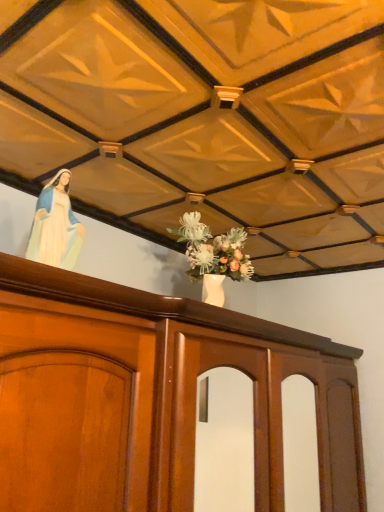
Question: Is smooth porcelain statue at upper left with wooden cabinet at center?

Choices:
 (A) no
 (B) yes

Answer: (A)

Question: Can you confirm if smooth porcelain statue at upper left is positioned to the right of wooden cabinet at center?

Choices:
 (A) no
 (B) yes

Answer: (A)

Question: Considering the relative sizes of smooth porcelain statue at upper left and wooden cabinet at center in the image provided, is smooth porcelain statue at upper left shorter than wooden cabinet at center?

Choices:
 (A) no
 (B) yes

Answer: (B)

Question: Is smooth porcelain statue at upper left looking in the opposite direction of wooden cabinet at center?

Choices:
 (A) no
 (B) yes

Answer: (A)

Question: Is smooth porcelain statue at upper left further to camera compared to wooden cabinet at center?

Choices:
 (A) no
 (B) yes

Answer: (B)

Question: From a real-world perspective, is smooth porcelain statue at upper left physically below wooden cabinet at center?

Choices:
 (A) no
 (B) yes

Answer: (A)

Question: Can you confirm if wooden cabinet at center is shorter than smooth porcelain statue at upper left?

Choices:
 (A) no
 (B) yes

Answer: (A)

Question: Can you confirm if wooden cabinet at center is wider than smooth porcelain statue at upper left?

Choices:
 (A) no
 (B) yes

Answer: (B)

Question: Does wooden cabinet at center touch smooth porcelain statue at upper left?

Choices:
 (A) no
 (B) yes

Answer: (A)

Question: Is wooden cabinet at center far away from smooth porcelain statue at upper left?

Choices:
 (A) yes
 (B) no

Answer: (B)

Question: Is wooden cabinet at center aimed at smooth porcelain statue at upper left?

Choices:
 (A) yes
 (B) no

Answer: (B)

Question: Does wooden cabinet at center have a larger size compared to smooth porcelain statue at upper left?

Choices:
 (A) no
 (B) yes

Answer: (B)

Question: Considering the positions of smooth porcelain statue at upper left and wooden cabinet at center in the image, is smooth porcelain statue at upper left taller or shorter than wooden cabinet at center?

Choices:
 (A) tall
 (B) short

Answer: (B)